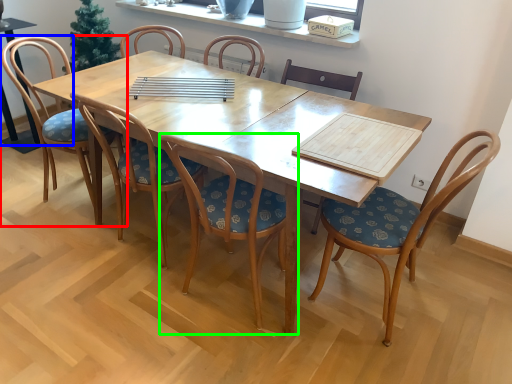
Question: Considering the real-world distances, which object is farthest from chair (highlighted by a red box)? armchair (highlighted by a blue box) or chair (highlighted by a green box)?

Choices:
 (A) armchair
 (B) chair

Answer: (B)